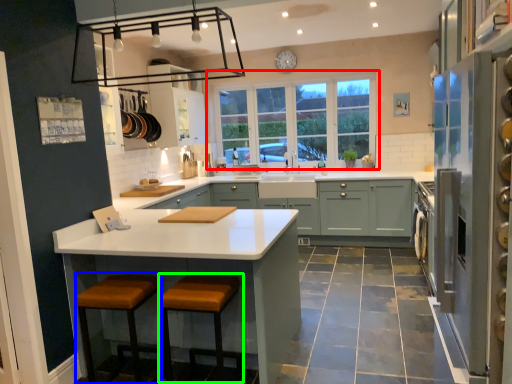
Question: Considering the real-world distances, which object is farthest from window (highlighted by a red box)? step stool (highlighted by a blue box) or step stool (highlighted by a green box)?

Choices:
 (A) step stool
 (B) step stool

Answer: (A)